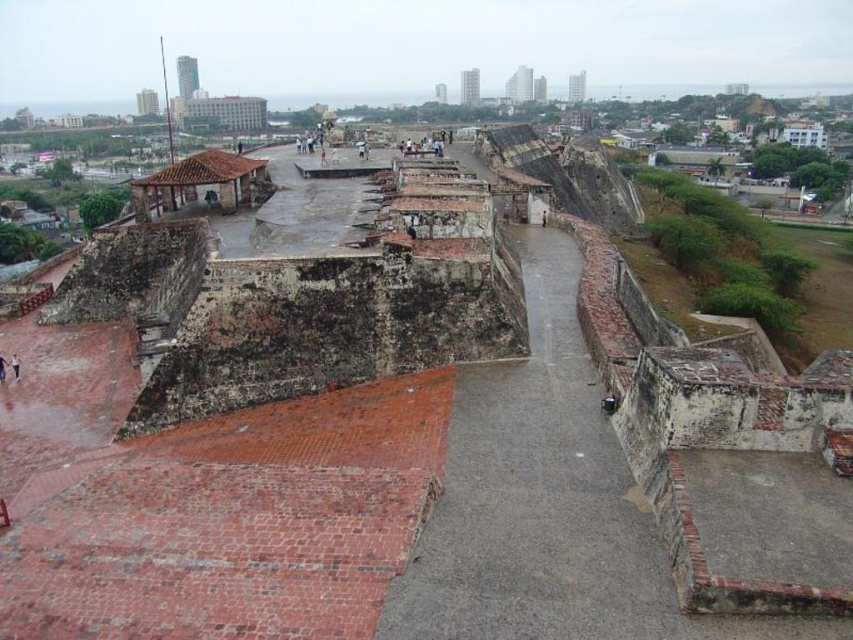
Question: Which point is farther to the camera?

Choices:
 (A) (4, 372)
 (B) (544, 225)
 (C) (601, 502)

Answer: (B)

Question: Considering the relative positions of brown leather shoe at lower left and dark gray stone person at center in the image provided, where is brown leather shoe at lower left located with respect to dark gray stone person at center?

Choices:
 (A) above
 (B) below

Answer: (B)

Question: Is brown leather shoe at lower left thinner than dark blue jeans at lower left?

Choices:
 (A) yes
 (B) no

Answer: (A)

Question: Estimate the real-world distances between objects in this image. Which object is farther from the smooth concrete path at center?

Choices:
 (A) brown leather shoe at lower left
 (B) dark blue jeans at lower left
 (C) dark gray stone person at center

Answer: (C)

Question: Which point is closer to the camera?

Choices:
 (A) (547, 307)
 (B) (3, 374)
 (C) (15, 355)

Answer: (B)

Question: Is brown leather shoe at lower left closer to camera compared to dark blue jeans at lower left?

Choices:
 (A) yes
 (B) no

Answer: (B)